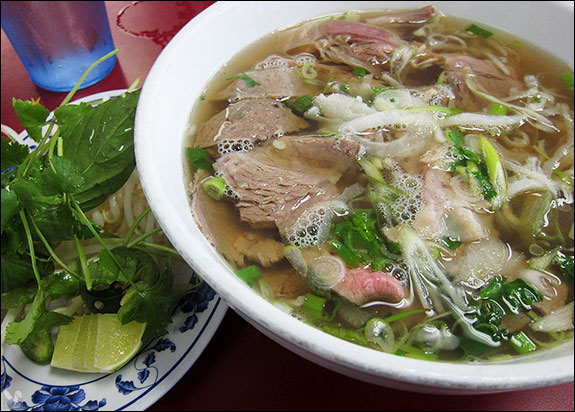
Identify the location of white plate with blue flowers. The height and width of the screenshot is (412, 575). (174, 360).